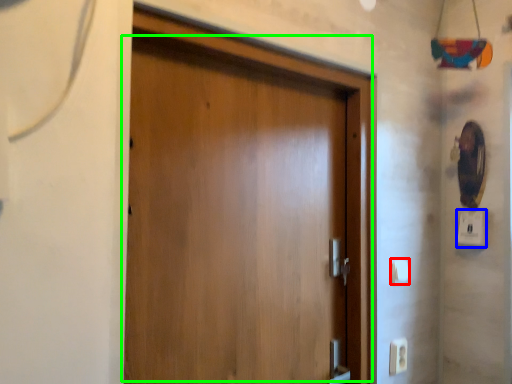
Question: Considering the real-world distances, which object is farthest from light switch (highlighted by a red box)? light switch (highlighted by a blue box) or door (highlighted by a green box)?

Choices:
 (A) light switch
 (B) door

Answer: (B)